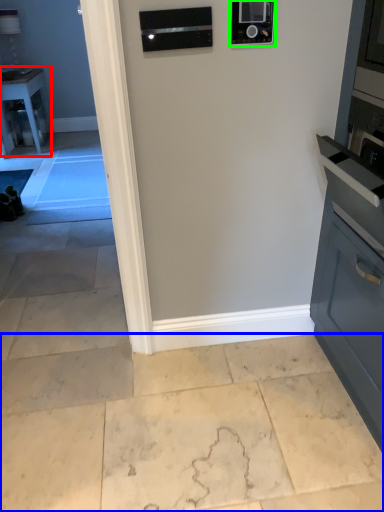
Question: Which object is the farthest from table (highlighted by a red box)? Choose among these: concrete (highlighted by a blue box) or appliance (highlighted by a green box).

Choices:
 (A) concrete
 (B) appliance

Answer: (B)